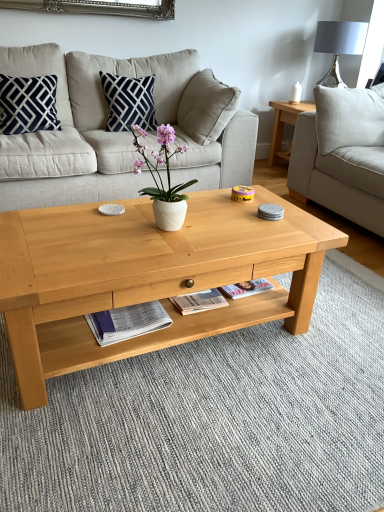
This screenshot has width=384, height=512. Find the location of `vacant space underneath white matte vase at center (from a real-world perspective)`. vacant space underneath white matte vase at center (from a real-world perspective) is located at coordinates (154, 232).